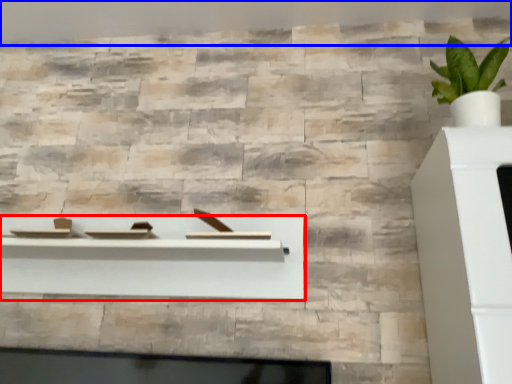
Question: Which object is closer to the camera taking this photo, shelf (highlighted by a red box) or backdrop (highlighted by a blue box)?

Choices:
 (A) shelf
 (B) backdrop

Answer: (A)